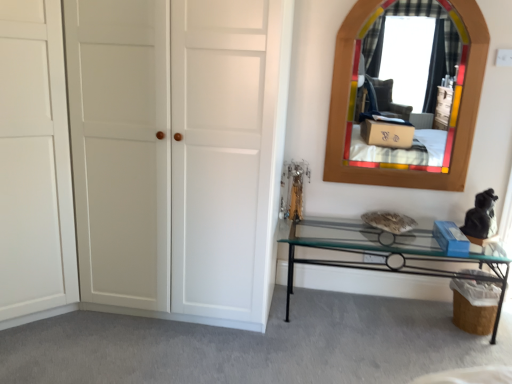
Locate an element on the screen. The height and width of the screenshot is (384, 512). white matte door at left, which is the 1th door in left-to-right order is located at coordinates (34, 162).

Image resolution: width=512 pixels, height=384 pixels. What do you see at coordinates (178, 153) in the screenshot?
I see `white matte door at left, the first door viewed from the right` at bounding box center [178, 153].

What is the approximate height of clear glass table at lower right?

The height of clear glass table at lower right is 39.95 centimeters.

This screenshot has width=512, height=384. I want to click on wooden stained mirror at upper right, so click(x=440, y=88).

Consider the image. Is white matte door at left, the second door viewed from the right, positioned behind wooden stained mirror at upper right?

That is False.

Between point (13, 5) and point (451, 153), which one is positioned behind?

Point (451, 153)

How far apart are white matte door at left, which is the 1th door in left-to-right order, and wooden stained mirror at upper right?

white matte door at left, which is the 1th door in left-to-right order, is 6.80 feet from wooden stained mirror at upper right.

Where is `mirror behind the white matte door at left, which is the 1th door in left-to-right order`? mirror behind the white matte door at left, which is the 1th door in left-to-right order is located at coordinates (440, 88).

Who is bigger, wooden stained mirror at upper right or white matte door at left, the second door viewed from the right?

With larger size is white matte door at left, the second door viewed from the right.

From a real-world perspective, is wooden stained mirror at upper right above or below white matte door at left, which is the 1th door in left-to-right order?

wooden stained mirror at upper right is above white matte door at left, which is the 1th door in left-to-right order.

Considering the positions of point (372, 32) and point (52, 106), is point (372, 32) closer or farther from the camera than point (52, 106)?

Point (372, 32) appears to be farther away from the viewer than point (52, 106).

Which is more to the right, wooden stained mirror at upper right or white matte door at left, the second door viewed from the right?

Positioned to the right is wooden stained mirror at upper right.

Consider the image. How different are the orientations of clear glass table at lower right and white matte door at left, the first door viewed from the right, in degrees?

They differ by 2.89e-05 degrees in their facing directions.

Looking at this image, in terms of height, does clear glass table at lower right look taller or shorter compared to white matte door at left, which is counted as the 2th door, starting from the left?

Considering their sizes, clear glass table at lower right has less height than white matte door at left, which is counted as the 2th door, starting from the left.

From the image's perspective, is clear glass table at lower right above or below white matte door at left, which is counted as the 2th door, starting from the left?

Clearly, from the image's perspective, clear glass table at lower right is below white matte door at left, which is counted as the 2th door, starting from the left.

Is clear glass table at lower right touching white matte door at left, the first door viewed from the right?

clear glass table at lower right and white matte door at left, the first door viewed from the right, are clearly separated.

From the image's perspective, starting from the wooden stained mirror at upper right, which door is the 1st one below? Please provide its 2D coordinates.

[(178, 153)]

From a real-world perspective, is white matte door at left, the first door viewed from the right, positioned over wooden stained mirror at upper right based on gravity?

No, from a real-world perspective, white matte door at left, the first door viewed from the right, is not over wooden stained mirror at upper right

Considering the sizes of white matte door at left, which is counted as the 2th door, starting from the left, and wooden stained mirror at upper right in the image, is white matte door at left, which is counted as the 2th door, starting from the left, bigger or smaller than wooden stained mirror at upper right?

white matte door at left, which is counted as the 2th door, starting from the left, is bigger than wooden stained mirror at upper right.

Considering the points (151, 246) and (451, 47), which point is behind, point (151, 246) or point (451, 47)?

The point (451, 47) is behind.

Is white matte door at left, the second door viewed from the right, inside the boundaries of white matte door at left, which is counted as the 2th door, starting from the left, or outside?

white matte door at left, the second door viewed from the right, cannot be found inside white matte door at left, which is counted as the 2th door, starting from the left.

Between white matte door at left, which is the 1th door in left-to-right order, and white matte door at left, which is counted as the 2th door, starting from the left, which one has larger size?

Bigger between the two is white matte door at left, which is the 1th door in left-to-right order.

From the image's perspective, is white matte door at left, the second door viewed from the right, located above white matte door at left, the first door viewed from the right?

No, from the image's perspective, white matte door at left, the second door viewed from the right, is not on top of white matte door at left, the first door viewed from the right.

Is white matte door at left, the second door viewed from the right, oriented towards white matte door at left, which is counted as the 2th door, starting from the left?

Yes, white matte door at left, the second door viewed from the right, is turned towards white matte door at left, which is counted as the 2th door, starting from the left.

Considering the relative sizes of clear glass table at lower right and white matte door at left, which is the 1th door in left-to-right order, in the image provided, is clear glass table at lower right bigger than white matte door at left, which is the 1th door in left-to-right order,?

No.

Based on the photo, how many degrees apart are the facing directions of clear glass table at lower right and white matte door at left, the second door viewed from the right?

They differ by 90 degrees in their facing directions.

Can you confirm if clear glass table at lower right is positioned to the left of white matte door at left, the second door viewed from the right?

In fact, clear glass table at lower right is to the right of white matte door at left, the second door viewed from the right.

From the image's perspective, starting from the clear glass table at lower right, which door is the 1st one above? Please provide its 2D coordinates.

[(34, 162)]

Can you confirm if wooden stained mirror at upper right is thinner than white matte door at left, which is counted as the 2th door, starting from the left?

Yes, wooden stained mirror at upper right is thinner than white matte door at left, which is counted as the 2th door, starting from the left.

Is wooden stained mirror at upper right facing away from white matte door at left, the first door viewed from the right?

No, white matte door at left, the first door viewed from the right, is not at the back of wooden stained mirror at upper right.

Does wooden stained mirror at upper right contain white matte door at left, which is counted as the 2th door, starting from the left?

No, white matte door at left, which is counted as the 2th door, starting from the left, is not surrounded by wooden stained mirror at upper right.

From a real-world perspective, is wooden stained mirror at upper right on white matte door at left, which is counted as the 2th door, starting from the left?

Indeed, from a real-world perspective, wooden stained mirror at upper right stands above white matte door at left, which is counted as the 2th door, starting from the left.

Identify the location of the 2nd door in front when counting from the wooden stained mirror at upper right. The image size is (512, 384). (34, 162).

I want to click on mirror that is above the white matte door at left, the second door viewed from the right (from the image's perspective), so click(440, 88).

From the image, which object appears to be nearer to white matte door at left, which is the 1th door in left-to-right order, clear glass table at lower right or wooden stained mirror at upper right?

clear glass table at lower right lies closer to white matte door at left, which is the 1th door in left-to-right order, than the other object.

Estimate the real-world distances between objects in this image. Which object is further from white matte door at left, the first door viewed from the right, wooden stained mirror at upper right or white matte door at left, the second door viewed from the right?

wooden stained mirror at upper right.

From the image, which object appears to be nearer to wooden stained mirror at upper right, clear glass table at lower right or white matte door at left, the first door viewed from the right?

Among the two, clear glass table at lower right is located nearer to wooden stained mirror at upper right.

From the image, which object appears to be farther from clear glass table at lower right, white matte door at left, which is counted as the 2th door, starting from the left, or wooden stained mirror at upper right?

white matte door at left, which is counted as the 2th door, starting from the left, lies further to clear glass table at lower right than the other object.

Looking at the image, which one is located closer to white matte door at left, which is the 1th door in left-to-right order, wooden stained mirror at upper right or clear glass table at lower right?

clear glass table at lower right is positioned closer to the anchor white matte door at left, which is the 1th door in left-to-right order.

Looking at the image, which one is located further to white matte door at left, the second door viewed from the right, white matte door at left, which is counted as the 2th door, starting from the left, or wooden stained mirror at upper right?

The object further to white matte door at left, the second door viewed from the right, is wooden stained mirror at upper right.

Which object lies nearer to the anchor point clear glass table at lower right, wooden stained mirror at upper right or white matte door at left, which is the 1th door in left-to-right order?

wooden stained mirror at upper right is closer to clear glass table at lower right.

Considering their positions, is white matte door at left, which is the 1th door in left-to-right order, positioned closer to white matte door at left, the first door viewed from the right, than wooden stained mirror at upper right?

Based on the image, white matte door at left, which is the 1th door in left-to-right order, appears to be nearer to white matte door at left, the first door viewed from the right.

Find the location of a particular element. Image resolution: width=512 pixels, height=384 pixels. door situated between white matte door at left, the second door viewed from the right, and wooden stained mirror at upper right from left to right is located at coordinates (178, 153).

Where is `table situated between white matte door at left, the second door viewed from the right, and wooden stained mirror at upper right from left to right`? This screenshot has height=384, width=512. table situated between white matte door at left, the second door viewed from the right, and wooden stained mirror at upper right from left to right is located at coordinates (387, 253).

Locate an element on the screen. The height and width of the screenshot is (384, 512). door between white matte door at left, which is the 1th door in left-to-right order, and clear glass table at lower right, in the horizontal direction is located at coordinates (178, 153).

You are a GUI agent. You are given a task and a screenshot of the screen. Output one action in this format:
    pyautogui.click(x=<x>, y=<y>)
    Task: Click on the table located between white matte door at left, the first door viewed from the right, and wooden stained mirror at upper right in the left-right direction
    The height and width of the screenshot is (384, 512).
    Given the screenshot: What is the action you would take?
    pyautogui.click(x=387, y=253)